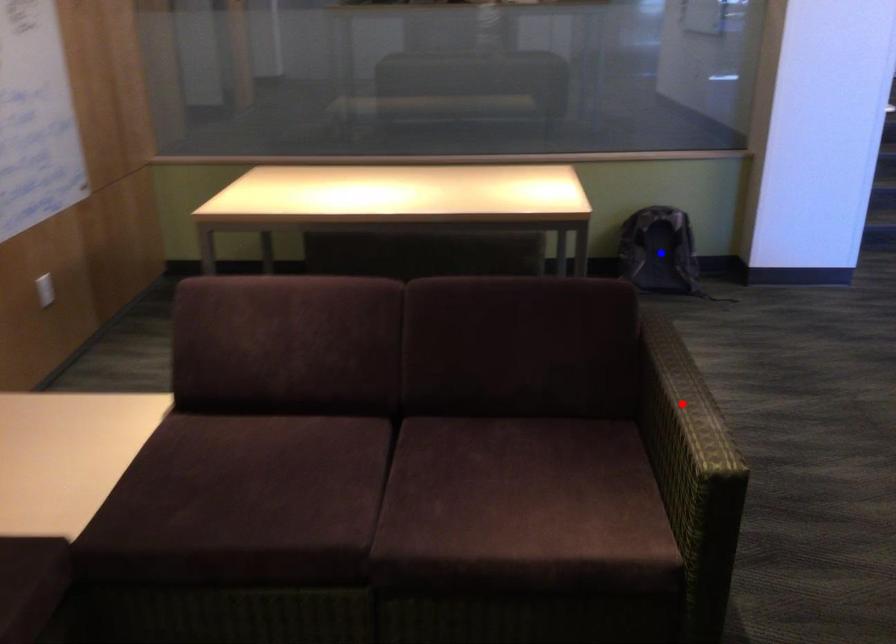
Question: Which of the two points in the image is closer to the camera?

Choices:
 (A) Blue point is closer.
 (B) Red point is closer.

Answer: (B)